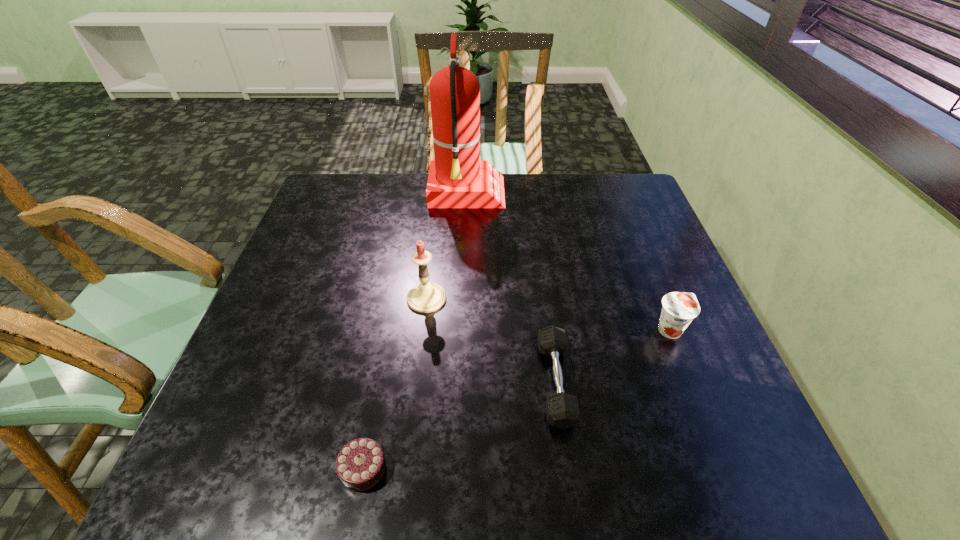
This screenshot has width=960, height=540. Find the location of `free region located on the right of the candle`. free region located on the right of the candle is located at coordinates (x=479, y=299).

You are a GUI agent. You are given a task and a screenshot of the screen. Output one action in this format:
    pyautogui.click(x=<x>, y=<y>)
    Task: Click on the vacant space situated on the back of the rightmost object
    
    Given the screenshot: What is the action you would take?
    pyautogui.click(x=638, y=250)

Identify the location of vacant space located 0.320m on the left of the second object from right to left. (385, 382).

Find the location of a particular element. The width and height of the screenshot is (960, 540). free space located 0.350m on the right of the nearest object is located at coordinates (586, 468).

At what (x,y) coordinates should I click in order to perform the action: click on object located at the far edge. Please return your answer as a coordinate pair (x, y). The height and width of the screenshot is (540, 960). Looking at the image, I should click on (457, 178).

You are a GUI agent. You are given a task and a screenshot of the screen. Output one action in this format:
    pyautogui.click(x=<x>, y=<y>)
    Task: Click on the object that is at the near edge
    This screenshot has width=960, height=540.
    Given the screenshot: What is the action you would take?
    pyautogui.click(x=360, y=465)

Find the location of a particular element. object that is at the right edge is located at coordinates (679, 308).

You are a GUI agent. You are given a task and a screenshot of the screen. Output one action in this format:
    pyautogui.click(x=<x>, y=<y>)
    Task: Click on the blank area at the far edge
    This screenshot has width=960, height=540.
    Given the screenshot: What is the action you would take?
    pyautogui.click(x=377, y=211)

The height and width of the screenshot is (540, 960). In order to click on vacant area at the near edge in this screenshot , I will do `click(409, 484)`.

Find the location of a particular element. free location at the left edge of the desktop is located at coordinates (277, 438).